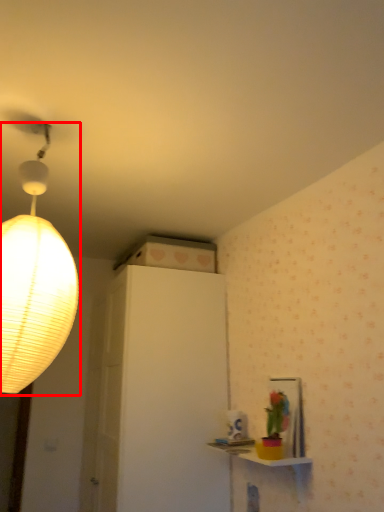
Question: Observing the image, what is the correct spatial positioning of lamp (annotated by the red box) in reference to table?

Choices:
 (A) right
 (B) left

Answer: (B)